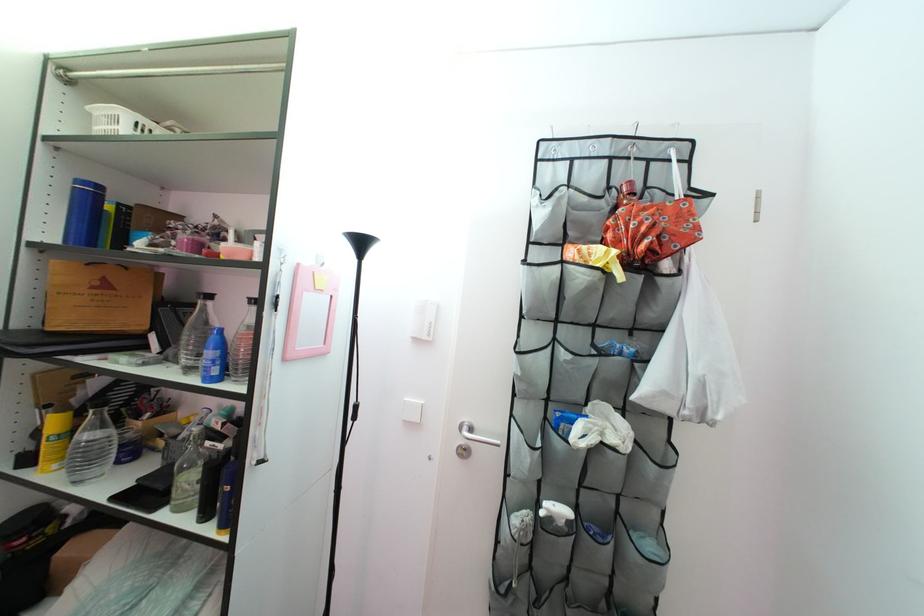
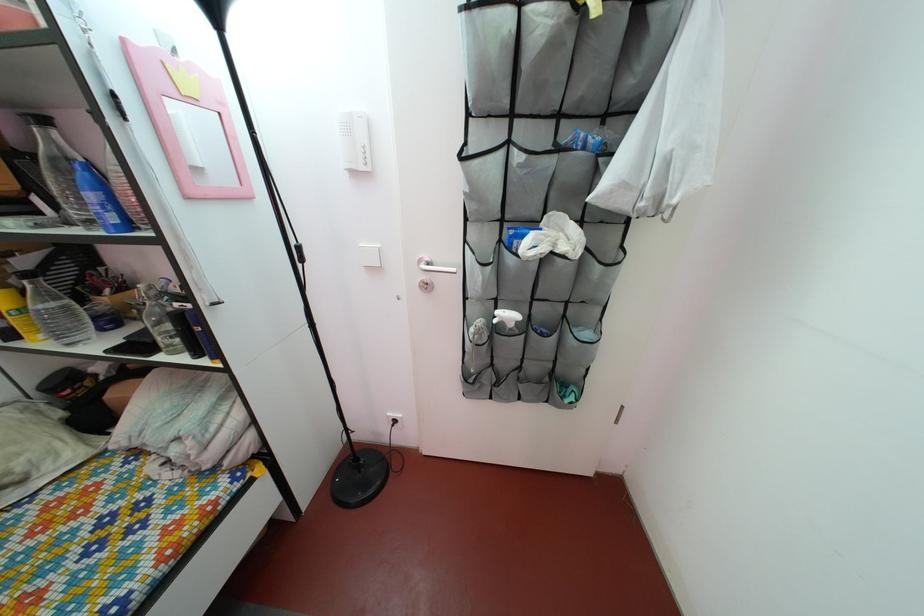
Locate, in the second image, the point that corresponds to pixel 224 381 in the first image.

(124, 229)